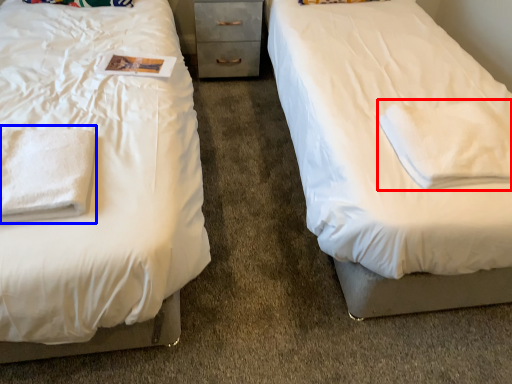
Question: Which object appears farthest to the camera in this image, cloth (highlighted by a red box) or cloth (highlighted by a blue box)?

Choices:
 (A) cloth
 (B) cloth

Answer: (A)